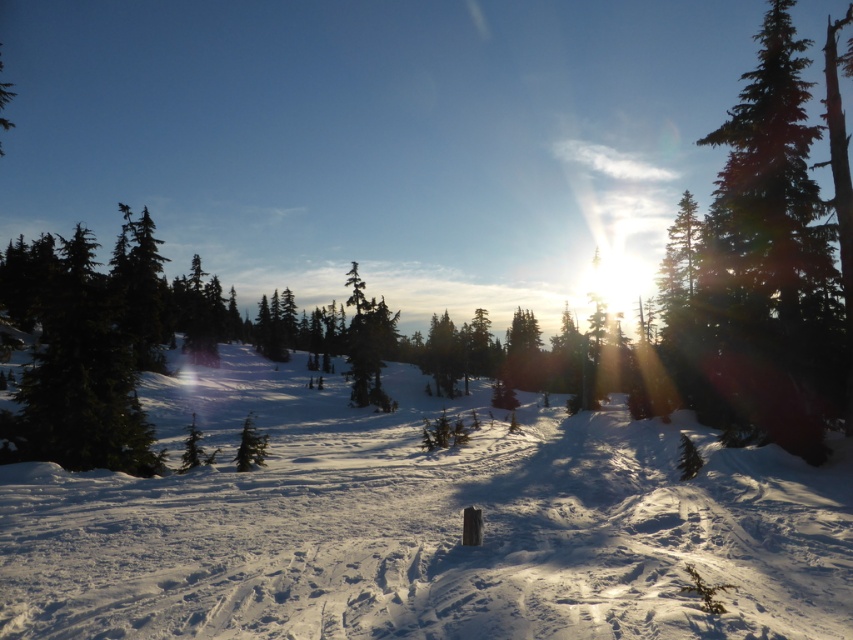
Between white powdery snow at center and green textured pine tree at right, which one appears on the right side from the viewer's perspective?

From the viewer's perspective, green textured pine tree at right appears more on the right side.

Who is higher up, white powdery snow at center or green textured pine tree at right?

green textured pine tree at right is above.

Measure the distance between white powdery snow at center and camera.

white powdery snow at center and camera are 21.55 feet apart from each other.

You are a GUI agent. You are given a task and a screenshot of the screen. Output one action in this format:
    pyautogui.click(x=<x>, y=<y>)
    Task: Click on the white powdery snow at center
    
    Given the screenshot: What is the action you would take?
    pyautogui.click(x=422, y=524)